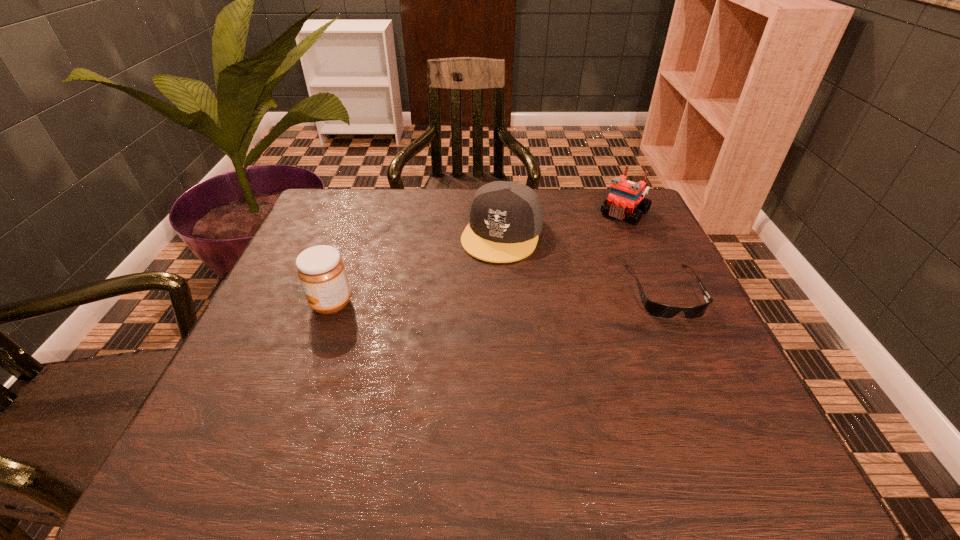
Where is `free space located 0.050m on the front-facing side of the Lego`? free space located 0.050m on the front-facing side of the Lego is located at coordinates (606, 233).

Image resolution: width=960 pixels, height=540 pixels. Find the location of `cap present at the far edge`. cap present at the far edge is located at coordinates (505, 218).

In order to click on Lego that is positioned at the far edge in this screenshot , I will do `click(624, 195)`.

The image size is (960, 540). In order to click on object positioned at the left edge in this screenshot , I will do (x=321, y=271).

Locate an element on the screen. The image size is (960, 540). sunglasses that is at the right edge is located at coordinates (658, 310).

You are a GUI agent. You are given a task and a screenshot of the screen. Output one action in this format:
    pyautogui.click(x=<x>, y=<y>)
    Task: Click on the Lego located at the right edge
    
    Given the screenshot: What is the action you would take?
    pyautogui.click(x=624, y=195)

Locate an element on the screen. object that is at the far right corner is located at coordinates click(624, 195).

In the image, there is a desktop. Identify the location of free space at the far edge. This screenshot has width=960, height=540. (565, 208).

Where is `free space at the near edge of the desktop`? The height and width of the screenshot is (540, 960). free space at the near edge of the desktop is located at coordinates (471, 415).

In the image, there is a desktop. Where is `free space at the left edge`? The height and width of the screenshot is (540, 960). free space at the left edge is located at coordinates coord(296,249).